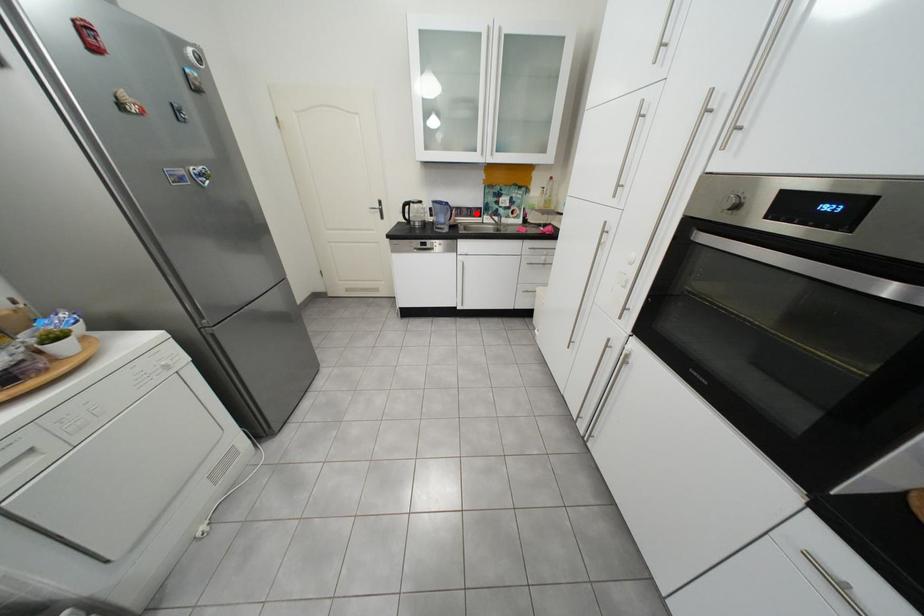
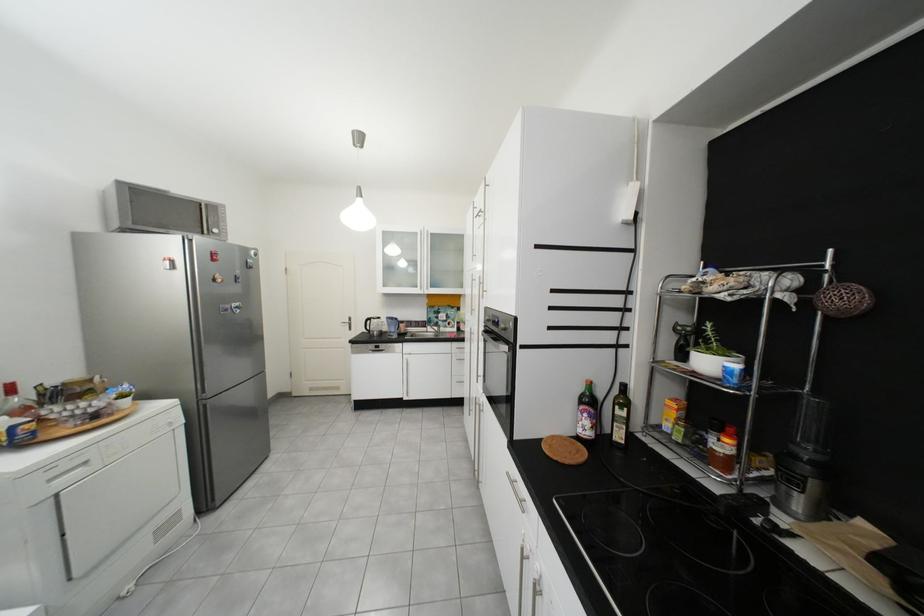
Question: I am providing you with two images of the same scene from different viewpoints. Given a red point in image1, look at the same physical point in image2. Is it:

Choices:
 (A) Closer to the viewpoint
 (B) Farther from the viewpoint

Answer: (B)